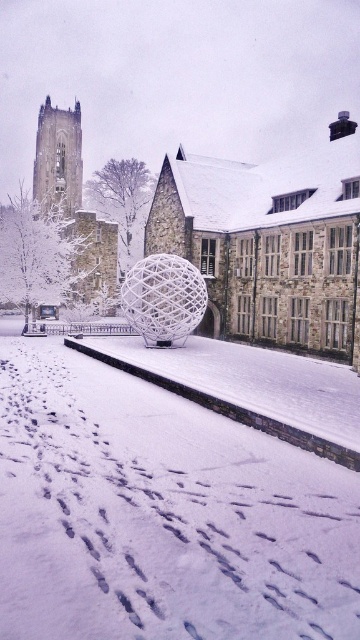
You are standing at the point marked as point (288, 163). You want to walk directly towards the large spherical sculpture made of white interwoven metal rods. How far will you have to walk to reach the sculpture?

The distance between the point (288, 163) and the large spherical sculpture made of white interwoven metal rods is 62.68 meters, so you will have to walk 62.68 meters to reach the sculpture.

You are a drone operator who needs to fly a drone from the white powdery snow at center to the stone tower at upper left. Given that the drone can only travel 300 feet before needing to recharge, will you need to recharge before reaching the destination?

The distance between the white powdery snow at center and the stone tower at upper left is 354.36 feet. Since the drone can only travel 300 feet before needing to recharge, you will need to recharge before reaching the destination.

You are standing at the point with coordinates point (75,108) and want to walk to the point with coordinates point (173,460). According to the image, will you have to walk towards or away from the large spherical sculpture made of white interwoven metal rods?

Since point (173,460) is in front of point (75,108), you will have to walk towards the large spherical sculpture made of white interwoven metal rods to reach it.